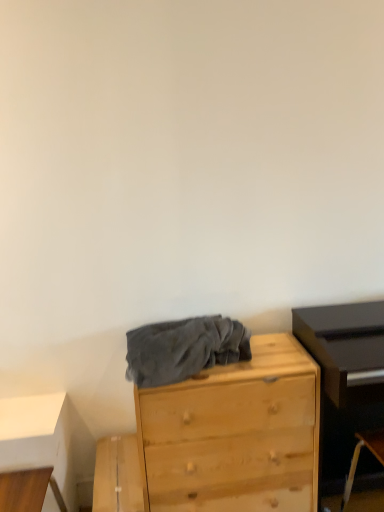
Question: Is gray fleece blanket at center beside light wood chest of drawers at center?

Choices:
 (A) yes
 (B) no

Answer: (B)

Question: Is gray fleece blanket at center facing away from light wood chest of drawers at center?

Choices:
 (A) no
 (B) yes

Answer: (A)

Question: Considering the relative sizes of gray fleece blanket at center and light wood chest of drawers at center in the image provided, is gray fleece blanket at center wider than light wood chest of drawers at center?

Choices:
 (A) no
 (B) yes

Answer: (A)

Question: Does gray fleece blanket at center appear on the left side of light wood chest of drawers at center?

Choices:
 (A) yes
 (B) no

Answer: (A)

Question: Considering the relative sizes of gray fleece blanket at center and light wood chest of drawers at center in the image provided, is gray fleece blanket at center shorter than light wood chest of drawers at center?

Choices:
 (A) no
 (B) yes

Answer: (B)

Question: Is gray fleece blanket at center taller or shorter than light wood chest of drawers at center?

Choices:
 (A) tall
 (B) short

Answer: (B)

Question: Is gray fleece blanket at center spatially inside light wood chest of drawers at center, or outside of it?

Choices:
 (A) inside
 (B) outside

Answer: (B)

Question: Visually, is gray fleece blanket at center positioned to the left or to the right of light wood chest of drawers at center?

Choices:
 (A) right
 (B) left

Answer: (B)

Question: Is gray fleece blanket at center in front of or behind light wood chest of drawers at center in the image?

Choices:
 (A) front
 (B) behind

Answer: (A)

Question: From a real-world perspective, is wooden table at lower left physically located above or below gray fleece blanket at center?

Choices:
 (A) above
 (B) below

Answer: (B)

Question: Do you think wooden table at lower left is within gray fleece blanket at center, or outside of it?

Choices:
 (A) outside
 (B) inside

Answer: (A)

Question: From their relative heights in the image, would you say wooden table at lower left is taller or shorter than gray fleece blanket at center?

Choices:
 (A) short
 (B) tall

Answer: (B)

Question: Visually, is wooden table at lower left positioned to the left or to the right of gray fleece blanket at center?

Choices:
 (A) left
 (B) right

Answer: (A)

Question: Is light wood chest of drawers at center in front of or behind wooden table at lower left in the image?

Choices:
 (A) behind
 (B) front

Answer: (B)

Question: In terms of height, does light wood chest of drawers at center look taller or shorter compared to wooden table at lower left?

Choices:
 (A) tall
 (B) short

Answer: (A)